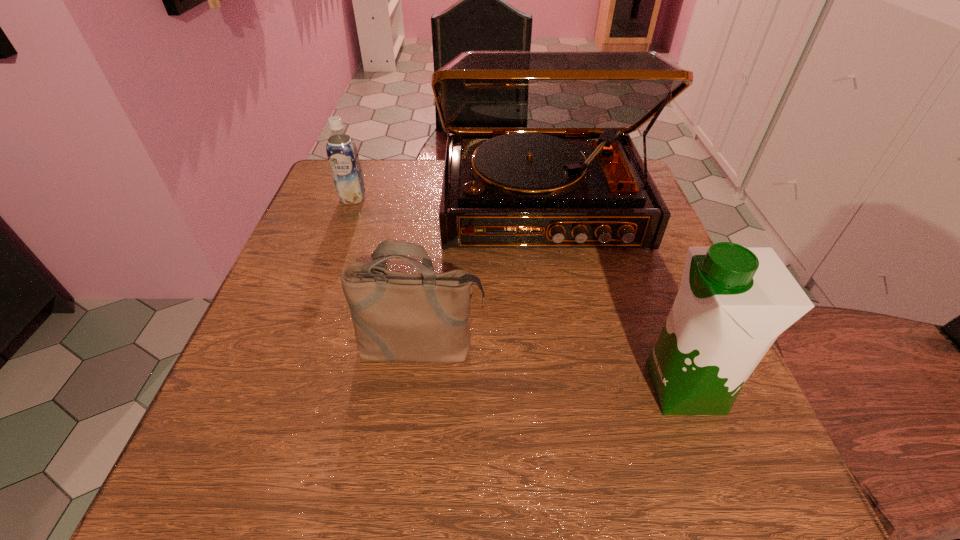
Image resolution: width=960 pixels, height=540 pixels. I want to click on vacant area situated 0.190m on the front-facing side of the shoulder bag, so click(404, 492).

Identify the location of vacant position located on the label of the farther soya milk. Image resolution: width=960 pixels, height=540 pixels. (301, 338).

I want to click on record player that is at the far edge, so click(538, 155).

I want to click on soya milk located at the far edge, so click(342, 154).

Find the location of a particular element. Image resolution: width=960 pixels, height=540 pixels. object present at the left edge is located at coordinates (342, 154).

You are a GUI agent. You are given a task and a screenshot of the screen. Output one action in this format:
    pyautogui.click(x=<x>, y=<y>)
    Task: Click on the record player that is positioned at the right edge
    The height and width of the screenshot is (540, 960).
    Given the screenshot: What is the action you would take?
    pyautogui.click(x=538, y=155)

Identify the location of soya milk that is positioned at the right edge. The image size is (960, 540). tap(733, 302).

The height and width of the screenshot is (540, 960). I want to click on object located in the far left corner section of the desktop, so click(342, 154).

Image resolution: width=960 pixels, height=540 pixels. I want to click on object at the far right corner, so click(x=538, y=155).

Locate an element on the screen. vacant position at the far edge of the desktop is located at coordinates (440, 173).